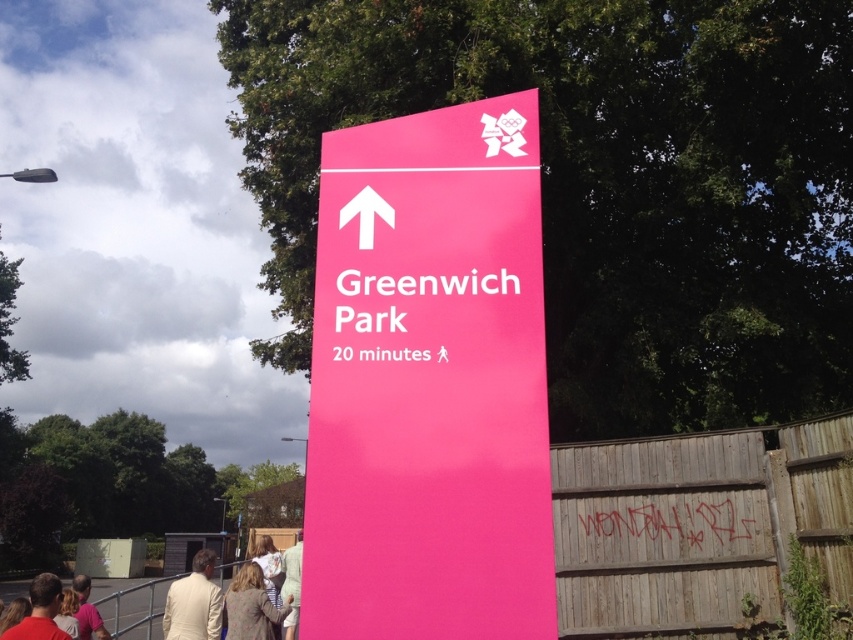
The height and width of the screenshot is (640, 853). I want to click on light beige cotton shirt at lower center, so click(x=292, y=584).

Can you confirm if light beige cotton shirt at lower center is shorter than light brown fabric shirt at lower center?

Yes.

Between point (287, 586) and point (271, 564), which one is positioned behind?

Positioned behind is point (271, 564).

Locate an element on the screen. This screenshot has height=640, width=853. light beige cotton shirt at lower center is located at coordinates (292, 584).

Which is below, blonde hair at lower left or light brown fabric shirt at lower center?

blonde hair at lower left is lower down.

Can you confirm if blonde hair at lower left is smaller than light brown fabric shirt at lower center?

Incorrect, blonde hair at lower left is not smaller in size than light brown fabric shirt at lower center.

Which is behind, point (33, 620) or point (273, 566)?

Positioned behind is point (273, 566).

At what (x,y) coordinates should I click in order to perform the action: click on blonde hair at lower left. Please return your answer as a coordinate pair (x, y). Looking at the image, I should click on (39, 611).

Who is more forward, (x=196, y=554) or (x=238, y=600)?

Point (x=238, y=600) is in front.

Between light beige suit at lower left and light brown textured coat at lower center, which one is positioned lower?

light beige suit at lower left

Identify the location of light beige suit at lower left. (194, 602).